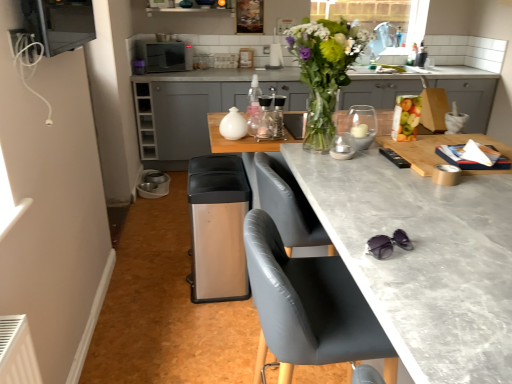
In order to click on vacant region to the left of translucent plastic bag of assorted fruits at right in this screenshot , I will do `click(380, 139)`.